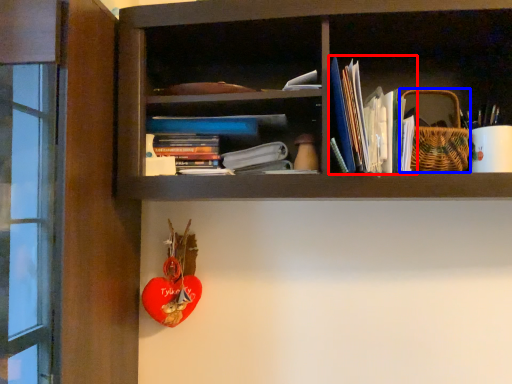
Question: Which point is closer to the camera, book (highlighted by a red box) or basket (highlighted by a blue box)?

Choices:
 (A) book
 (B) basket

Answer: (A)